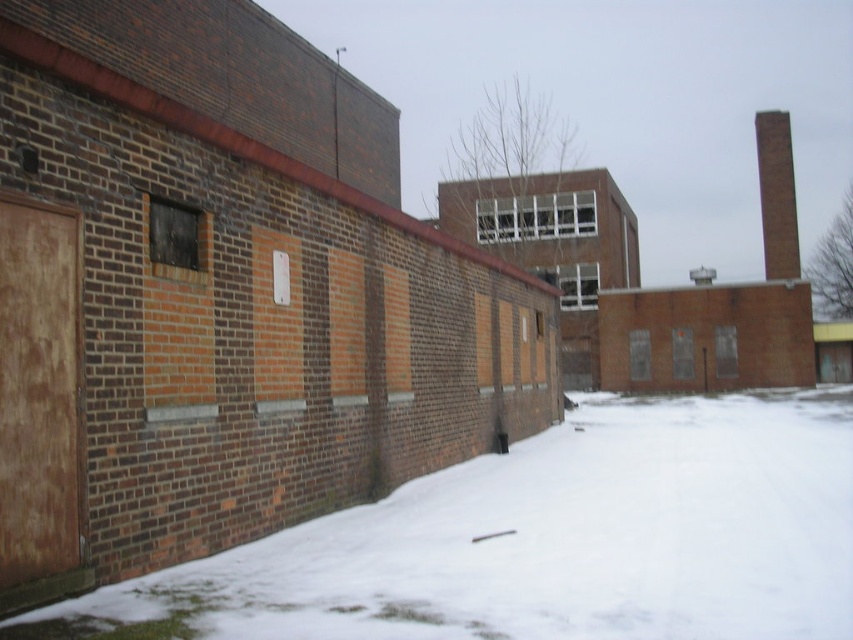
Is white powdery snow at lower left bigger than brick chimney at upper right?

No, white powdery snow at lower left is not bigger than brick chimney at upper right.

Where is `white powdery snow at lower left`? white powdery snow at lower left is located at coordinates (550, 540).